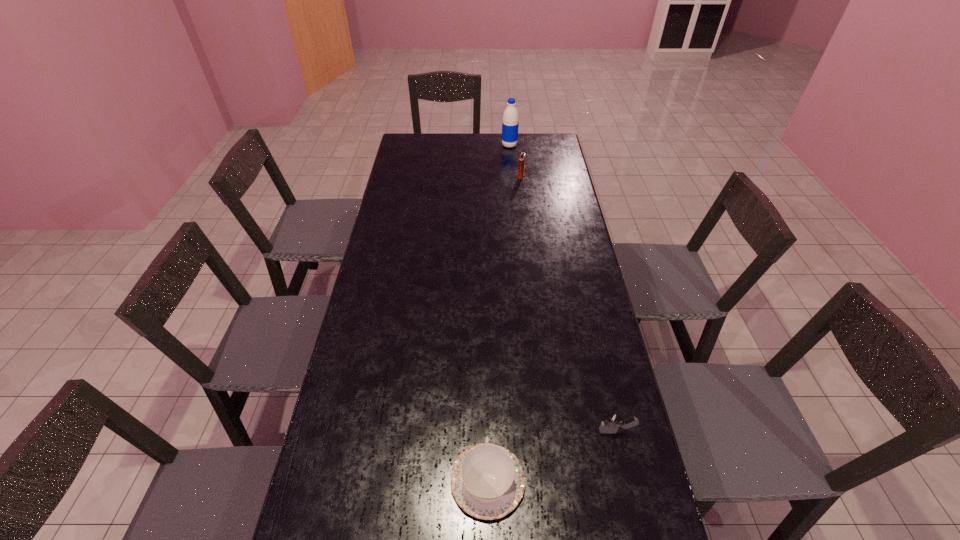
The width and height of the screenshot is (960, 540). I want to click on vacant space situated on the left of the rightmost object, so click(x=539, y=431).

At what (x,y) coordinates should I click in order to perform the action: click on free region located on the handle side of the nearest object. Please return your answer as a coordinate pair (x, y). Looking at the image, I should click on (486, 350).

Locate an element on the screen. The width and height of the screenshot is (960, 540). vacant space located 0.390m on the handle side of the nearest object is located at coordinates (486, 320).

Locate an element on the screen. The width and height of the screenshot is (960, 540). free region located on the handle side of the nearest object is located at coordinates (487, 387).

You are a GUI agent. You are given a task and a screenshot of the screen. Output one action in this format:
    pyautogui.click(x=<x>, y=<y>)
    Task: Click on the object present at the far edge
    The height and width of the screenshot is (540, 960).
    Given the screenshot: What is the action you would take?
    pyautogui.click(x=510, y=123)

Locate an element on the screen. This screenshot has height=540, width=960. object that is positioned at the right edge is located at coordinates (611, 422).

The width and height of the screenshot is (960, 540). In the image, there is a desktop. In order to click on free region at the far edge in this screenshot , I will do `click(524, 143)`.

You are a GUI agent. You are given a task and a screenshot of the screen. Output one action in this format:
    pyautogui.click(x=<x>, y=<y>)
    Task: Click on the free region at the left edge of the desktop
    The image size is (960, 540).
    Given the screenshot: What is the action you would take?
    pyautogui.click(x=390, y=182)

Where is `free space at the right edge`? Image resolution: width=960 pixels, height=540 pixels. free space at the right edge is located at coordinates (560, 300).

This screenshot has height=540, width=960. I want to click on free point at the far left corner, so click(405, 152).